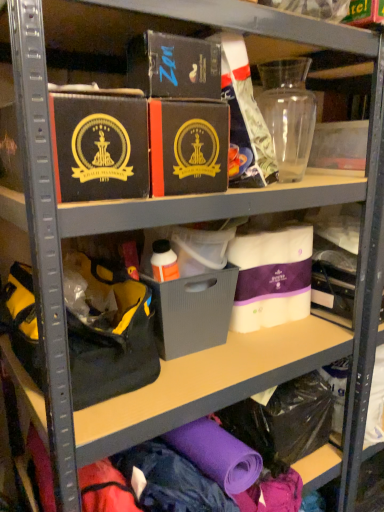
Question: Does matte black box at upper left, positioned as the 1th box in left-to-right order, have a larger size compared to gray matte storage box at center?

Choices:
 (A) yes
 (B) no

Answer: (B)

Question: Does matte black box at upper left, which ranks as the fourth box in right-to-left order, have a greater width compared to gray matte storage box at center?

Choices:
 (A) no
 (B) yes

Answer: (B)

Question: Is gray matte storage box at center a part of matte black box at upper left, positioned as the 1th box in left-to-right order?

Choices:
 (A) no
 (B) yes

Answer: (A)

Question: From the image's perspective, would you say matte black box at upper left, which ranks as the fourth box in right-to-left order, is positioned over gray matte storage box at center?

Choices:
 (A) no
 (B) yes

Answer: (B)

Question: Can you confirm if matte black box at upper left, positioned as the 1th box in left-to-right order, is shorter than gray matte storage box at center?

Choices:
 (A) no
 (B) yes

Answer: (B)

Question: Considering the relative sizes of matte black box at upper left, positioned as the 1th box in left-to-right order, and gray matte storage box at center in the image provided, is matte black box at upper left, positioned as the 1th box in left-to-right order, smaller than gray matte storage box at center?

Choices:
 (A) no
 (B) yes

Answer: (B)

Question: Would you say gray matte storage box at center is outside white fabric quilted mattress at center, which is counted as the 4th box, starting from the left?

Choices:
 (A) yes
 (B) no

Answer: (A)

Question: From the image's perspective, is gray matte storage box at center located above white fabric quilted mattress at center, the first box when ordered from right to left?

Choices:
 (A) yes
 (B) no

Answer: (B)

Question: Is gray matte storage box at center further to camera compared to white fabric quilted mattress at center, the first box when ordered from right to left?

Choices:
 (A) yes
 (B) no

Answer: (B)

Question: From a real-world perspective, is gray matte storage box at center under white fabric quilted mattress at center, the first box when ordered from right to left?

Choices:
 (A) no
 (B) yes

Answer: (B)

Question: From the image's perspective, is gray matte storage box at center below white fabric quilted mattress at center, which is counted as the 4th box, starting from the left?

Choices:
 (A) no
 (B) yes

Answer: (B)

Question: Considering the relative positions of gray matte storage box at center and white fabric quilted mattress at center, the first box when ordered from right to left, in the image provided, is gray matte storage box at center to the left of white fabric quilted mattress at center, the first box when ordered from right to left, from the viewer's perspective?

Choices:
 (A) yes
 (B) no

Answer: (A)

Question: Could you tell me if matte black box at center, the second box in the left-to-right sequence, is facing white fabric quilted mattress at center, the first box when ordered from right to left?

Choices:
 (A) yes
 (B) no

Answer: (B)